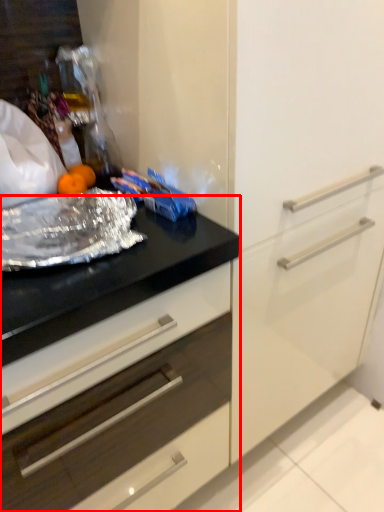
Question: From the image, what is the correct spatial relationship of countertop (annotated by the red box) in relation to material?

Choices:
 (A) right
 (B) left

Answer: (B)